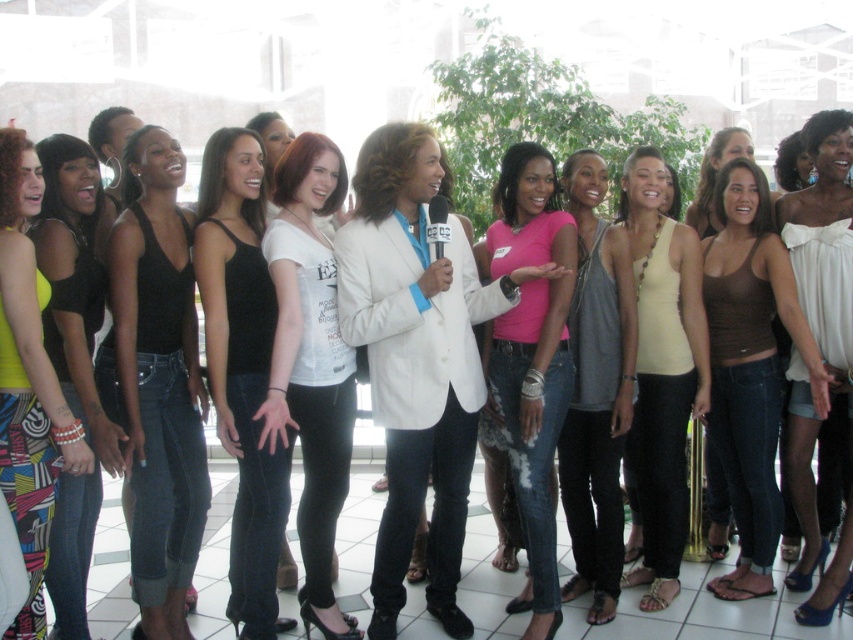
Question: Observing the image, what is the correct spatial positioning of brown matte tank top at center in reference to gray cotton tank top at center?

Choices:
 (A) right
 (B) left

Answer: (A)

Question: Which of the following is the farthest from the observer?

Choices:
 (A) white matte t-shirt at center
 (B) matte black tank top at center
 (C) yellow-green fabric top at left
 (D) white chiffon strapless top at center

Answer: (B)

Question: Which object appears farthest from the camera in this image?

Choices:
 (A) black denim jeans at center
 (B) white matte blazer at center
 (C) matte black tank top at center
 (D) pink jersey at center

Answer: (C)

Question: Which object is the closest to the white matte t-shirt at center?

Choices:
 (A) matte black tank top at center
 (B) white matte blazer at center

Answer: (A)

Question: Does white matte blazer at center appear under matte black tank top at center?

Choices:
 (A) yes
 (B) no

Answer: (A)

Question: In this image, where is pink jersey at center located relative to yellow-green fabric top at left?

Choices:
 (A) below
 (B) above

Answer: (A)